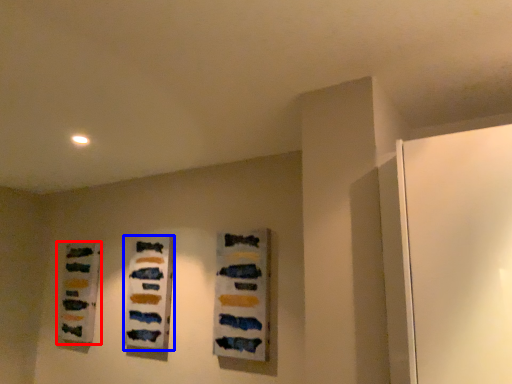
Question: Among these objects, which one is farthest to the camera, art (highlighted by a red box) or art (highlighted by a blue box)?

Choices:
 (A) art
 (B) art

Answer: (A)